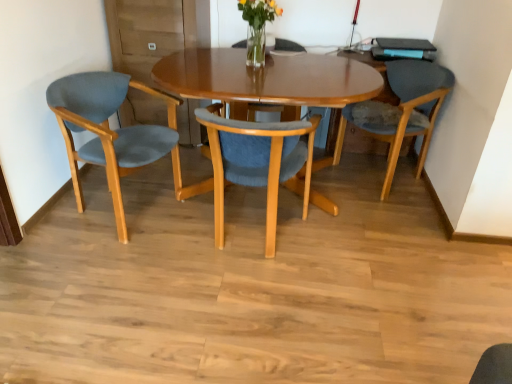
Question: Can you confirm if matte blue cushioned chair at right, placed as the third chair when sorted from left to right, is shorter than matte wood chair at center, positioned as the 2th chair in right-to-left order?

Choices:
 (A) no
 (B) yes

Answer: (A)

Question: From the image's perspective, is matte blue cushioned chair at right, the 1th chair viewed from the right, below matte wood chair at center, positioned as the 2th chair in right-to-left order?

Choices:
 (A) yes
 (B) no

Answer: (B)

Question: Is matte blue cushioned chair at right, placed as the third chair when sorted from left to right, positioned before matte wood chair at center, positioned as the 2th chair in right-to-left order?

Choices:
 (A) yes
 (B) no

Answer: (B)

Question: Is matte wood chair at center, acting as the 2th chair starting from the left, inside matte blue cushioned chair at right, the 1th chair viewed from the right?

Choices:
 (A) no
 (B) yes

Answer: (A)

Question: Does matte blue cushioned chair at right, the 1th chair viewed from the right, have a lesser width compared to matte wood chair at center, acting as the 2th chair starting from the left?

Choices:
 (A) no
 (B) yes

Answer: (A)

Question: Looking at their shapes, would you say matte blue fabric chair at left, the 1th chair in the left-to-right sequence, is wider or thinner than matte blue cushioned chair at right, placed as the third chair when sorted from left to right?

Choices:
 (A) thin
 (B) wide

Answer: (A)

Question: Does point (130, 150) appear closer or farther from the camera than point (404, 89)?

Choices:
 (A) farther
 (B) closer

Answer: (B)

Question: Is matte blue fabric chair at left, arranged as the 3th chair when viewed from the right, to the left or to the right of matte blue cushioned chair at right, the 1th chair viewed from the right, in the image?

Choices:
 (A) right
 (B) left

Answer: (B)

Question: Do you think matte blue fabric chair at left, the 1th chair in the left-to-right sequence, is within matte blue cushioned chair at right, placed as the third chair when sorted from left to right, or outside of it?

Choices:
 (A) outside
 (B) inside

Answer: (A)

Question: Is matte wood chair at center, positioned as the 2th chair in right-to-left order, in front of or behind matte blue cushioned chair at right, placed as the third chair when sorted from left to right, in the image?

Choices:
 (A) front
 (B) behind

Answer: (A)

Question: From a real-world perspective, is matte wood chair at center, positioned as the 2th chair in right-to-left order, above or below matte blue cushioned chair at right, placed as the third chair when sorted from left to right?

Choices:
 (A) below
 (B) above

Answer: (A)

Question: Is matte wood chair at center, positioned as the 2th chair in right-to-left order, spatially inside matte blue cushioned chair at right, placed as the third chair when sorted from left to right, or outside of it?

Choices:
 (A) inside
 (B) outside

Answer: (B)

Question: Looking at the image, does matte wood chair at center, positioned as the 2th chair in right-to-left order, seem bigger or smaller compared to matte blue cushioned chair at right, the 1th chair viewed from the right?

Choices:
 (A) small
 (B) big

Answer: (A)

Question: Is translucent glass vase at upper center in front of or behind matte wood chair at center, acting as the 2th chair starting from the left, in the image?

Choices:
 (A) front
 (B) behind

Answer: (B)

Question: Is translucent glass vase at upper center wider or thinner than matte wood chair at center, positioned as the 2th chair in right-to-left order?

Choices:
 (A) thin
 (B) wide

Answer: (A)